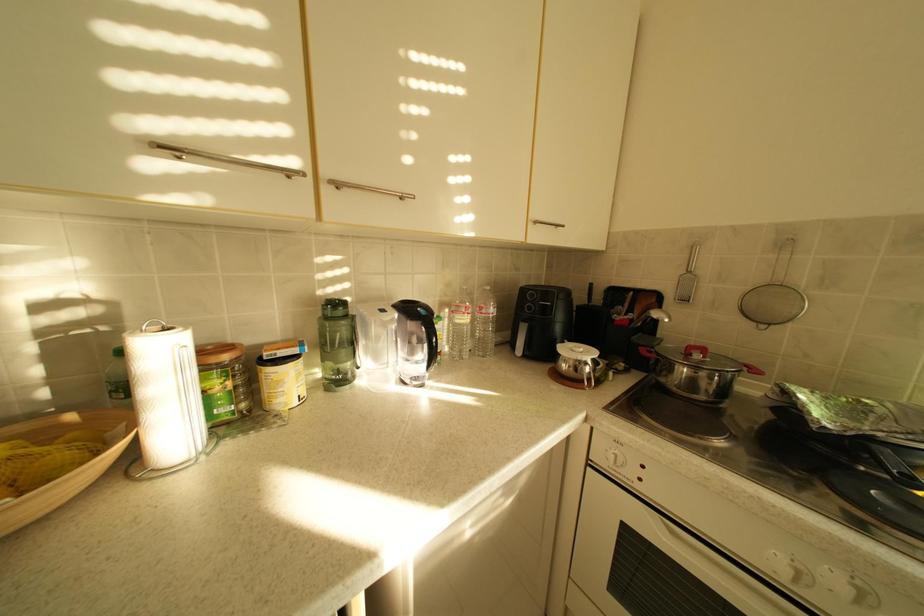
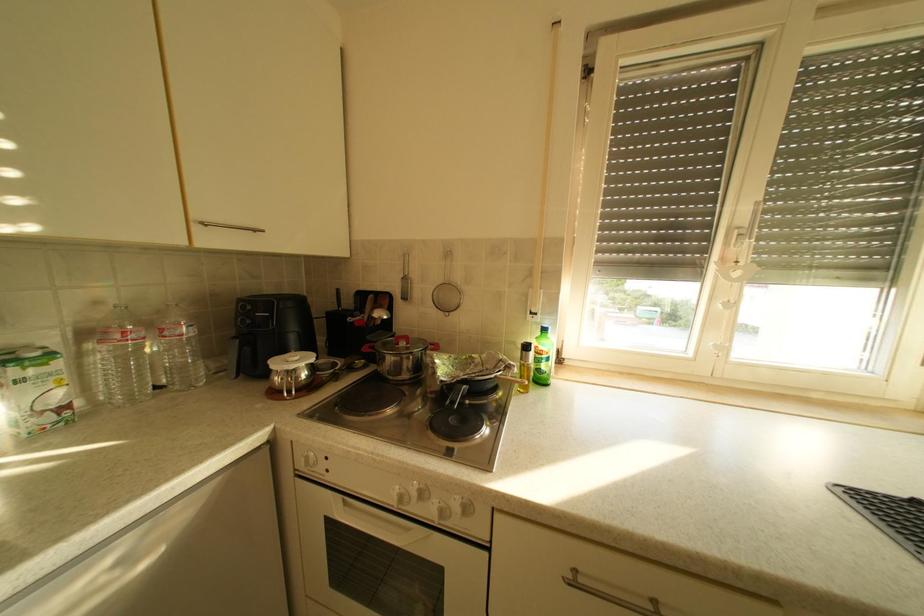
Question: The images are taken continuously from a first-person perspective. In which direction is your viewpoint rotating?

Choices:
 (A) Left
 (B) Right
 (C) Up
 (D) Down

Answer: (B)